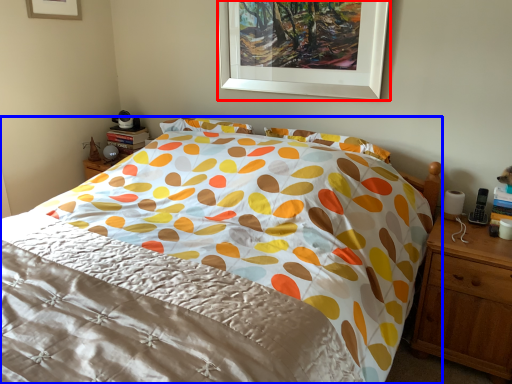
Question: Which point is further to the camera, picture frame (highlighted by a red box) or bed (highlighted by a blue box)?

Choices:
 (A) picture frame
 (B) bed

Answer: (A)